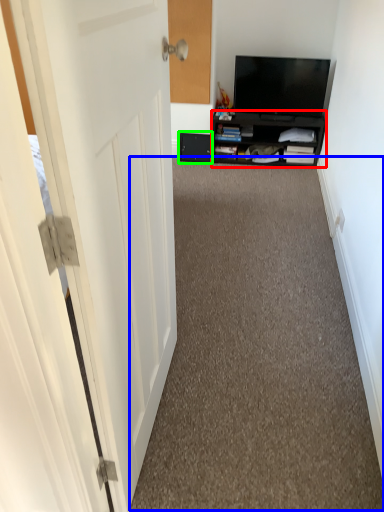
Question: Based on their relative distances, which object is nearer to cabinetry (highlighted by a red box)? Choose from corridor (highlighted by a blue box) and drawer (highlighted by a green box).

Choices:
 (A) corridor
 (B) drawer

Answer: (B)